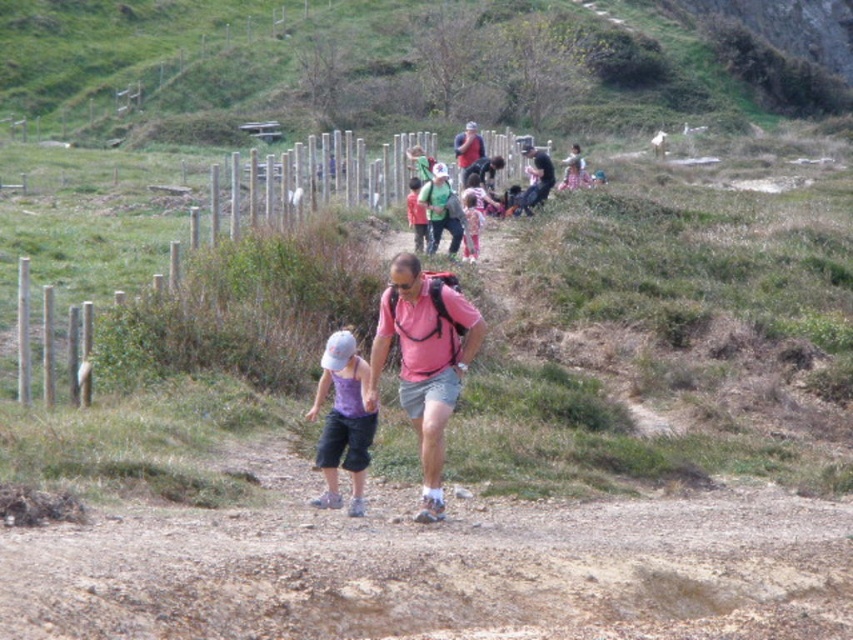
Question: Among these points, which one is farthest from the camera?

Choices:
 (A) (410, 369)
 (B) (344, 356)

Answer: (A)

Question: In this image, where is matte pink shirt at center located relative to green fabric jacket at upper center?

Choices:
 (A) left
 (B) right

Answer: (A)

Question: From the image, what is the correct spatial relationship of matte pink shirt at center in relation to green fabric jacket at upper center?

Choices:
 (A) below
 (B) above

Answer: (A)

Question: Observing the image, what is the correct spatial positioning of matte pink shirt at center in reference to light purple fabric shirt at center?

Choices:
 (A) left
 (B) right

Answer: (B)

Question: Considering the real-world distances, which object is farthest from the light purple fabric shirt at center?

Choices:
 (A) matte pink shirt at center
 (B) green fabric jacket at upper center

Answer: (B)

Question: Which of the following is the closest to the observer?

Choices:
 (A) (370, 442)
 (B) (368, 392)
 (C) (433, 212)

Answer: (B)